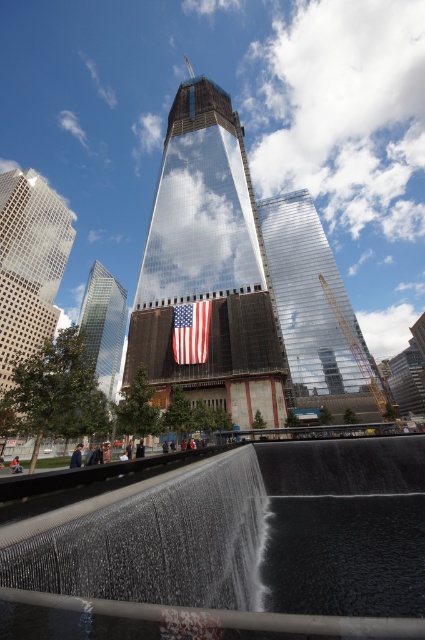
You are a drone operator tasked with capturing aerial footage of the reflective glass skyscraper at center and the american flag at center. Your drone has a maximum flight range of 30 meters. Can you fly the drone from the skyscraper to the flag without exceeding its range?

The reflective glass skyscraper at center and the american flag at center are 28.24 meters apart from each other. Since the drone has a maximum flight range of 30 meters, it can safely fly from the skyscraper to the flag without exceeding its range.

You are standing in front of the skyscraper under construction and want to reach the point marked at coordinates point (172, 600). Given that the water feature is between you and the point, can you safely walk directly to the point without getting wet?

The point (172, 600) is 7.38 meters away from the viewer. Since the water feature is between you and the point, you would need to navigate around it to avoid getting wet. Walking directly might lead to the water area, so it is safer to go around.

You are standing at the memorial park and want to take a photo of the reflective glass skyscraper at center. However, the black smooth water at lower center is blocking your view. Can you move to the right to get a clear shot of the skyscraper?

The black smooth water at lower center is located below the reflective glass skyscraper at center, so moving to the right might allow you to position yourself above the water and get a clear view of the skyscraper.